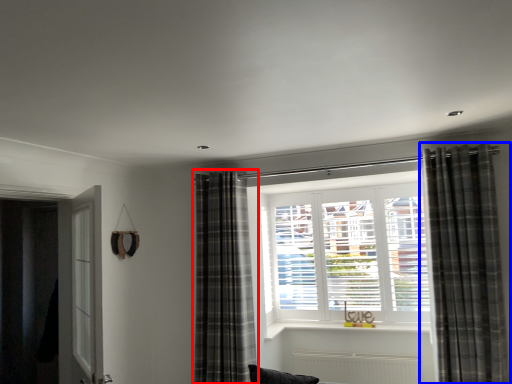
Question: Which point is further to the camera, curtain (highlighted by a red box) or curtain (highlighted by a blue box)?

Choices:
 (A) curtain
 (B) curtain

Answer: (A)